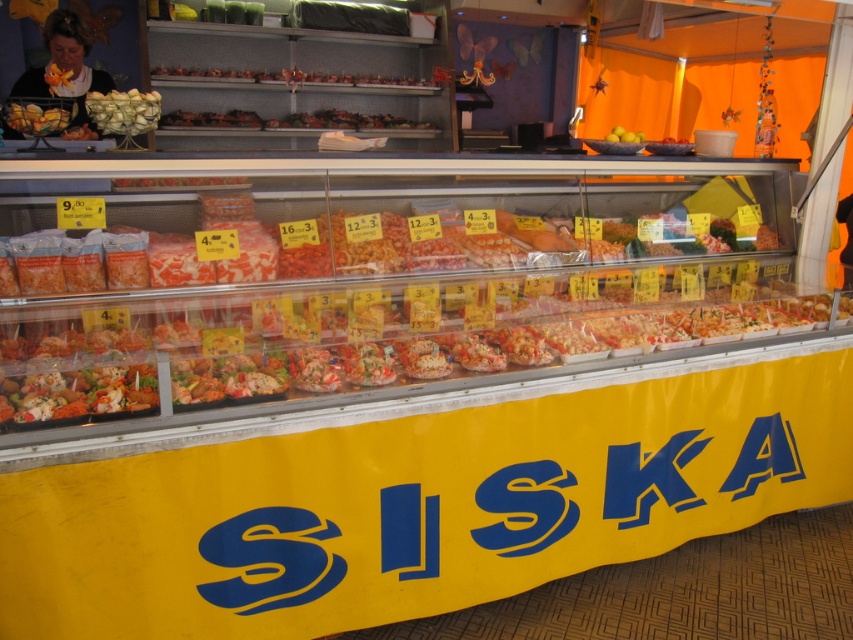
Which of these two, green matte vegetables at upper left or yellow matte lemons at upper right, stands taller?

green matte vegetables at upper left

Is green matte vegetables at upper left to the left of yellow matte lemons at upper right from the viewer's perspective?

Yes, green matte vegetables at upper left is to the left of yellow matte lemons at upper right.

Between point (90, 115) and point (613, 134), which one is positioned behind?

The point (613, 134) is behind.

The image size is (853, 640). I want to click on green matte vegetables at upper left, so click(x=123, y=112).

Is green matte vegetables at upper left thinner than matte plastic bag at upper left?

Incorrect, green matte vegetables at upper left's width is not less than matte plastic bag at upper left's.

Is green matte vegetables at upper left bigger than matte plastic bag at upper left?

Yes, green matte vegetables at upper left is bigger than matte plastic bag at upper left.

Which is behind, point (128, 93) or point (74, 125)?

The point (74, 125) is behind.

Identify the location of green matte vegetables at upper left. The width and height of the screenshot is (853, 640). (123, 112).

Which is above, shiny plastic salad at lower left or matte plastic bag at upper left?

Positioned higher is matte plastic bag at upper left.

The width and height of the screenshot is (853, 640). What are the coordinates of `shiny plastic salad at lower left` in the screenshot? It's located at (381, 333).

Locate an element on the screen. Image resolution: width=853 pixels, height=640 pixels. shiny plastic salad at lower left is located at coordinates (381, 333).